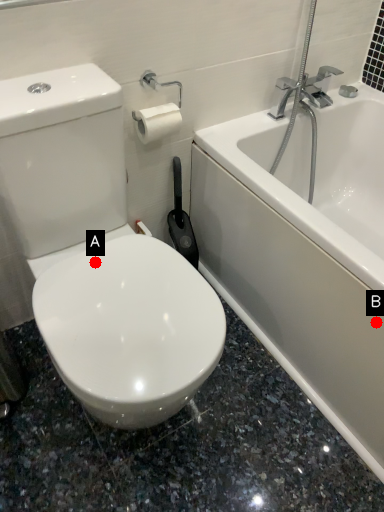
Question: Two points are circled on the image, labeled by A and B beside each circle. Among these points, which one is farthest from the camera?

Choices:
 (A) A is further
 (B) B is further

Answer: (A)